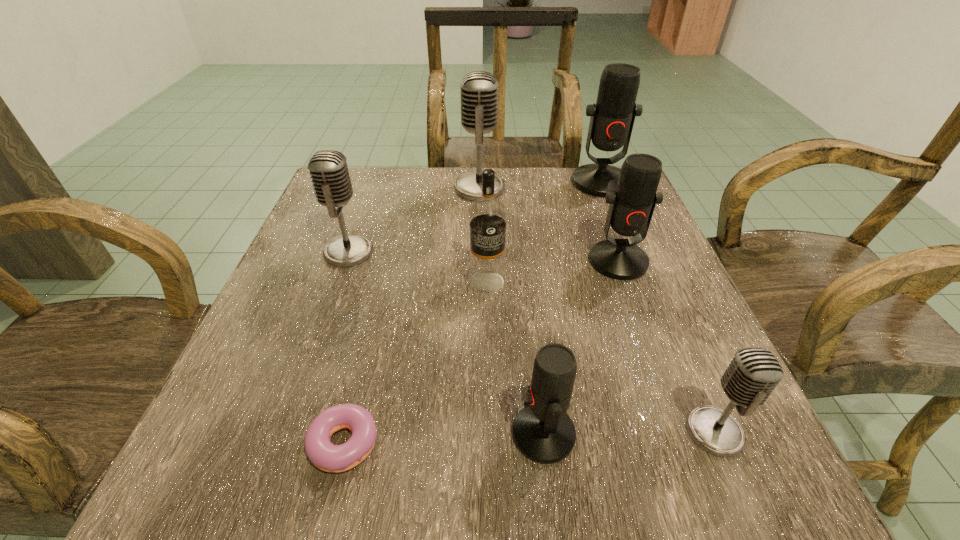
This screenshot has height=540, width=960. I want to click on blank space at the near edge, so click(x=414, y=501).

Locate an element on the screen. This screenshot has height=540, width=960. vacant area at the left edge is located at coordinates (278, 327).

Where is `vacant space at the right edge`? The image size is (960, 540). vacant space at the right edge is located at coordinates (662, 381).

Find the location of a particular element. The height and width of the screenshot is (540, 960). free spot at the far left corner of the desktop is located at coordinates (384, 168).

Identify the location of free space at the far right corner of the desktop. Image resolution: width=960 pixels, height=540 pixels. (591, 204).

Image resolution: width=960 pixels, height=540 pixels. In order to click on empty location between the nearest gray microphone and the vodka in this screenshot , I will do `click(601, 357)`.

Where is `empty space between the biggest gray microphone and the nearest red microphone`? Image resolution: width=960 pixels, height=540 pixels. empty space between the biggest gray microphone and the nearest red microphone is located at coordinates (512, 311).

Where is `vacant area between the vodka and the doughnut`? Image resolution: width=960 pixels, height=540 pixels. vacant area between the vodka and the doughnut is located at coordinates (413, 363).

This screenshot has width=960, height=540. Find the location of `free point between the vodka and the shortest object`. free point between the vodka and the shortest object is located at coordinates (413, 363).

The height and width of the screenshot is (540, 960). Identify the location of unoccupied area between the smallest gray microphone and the vodka. (601, 357).